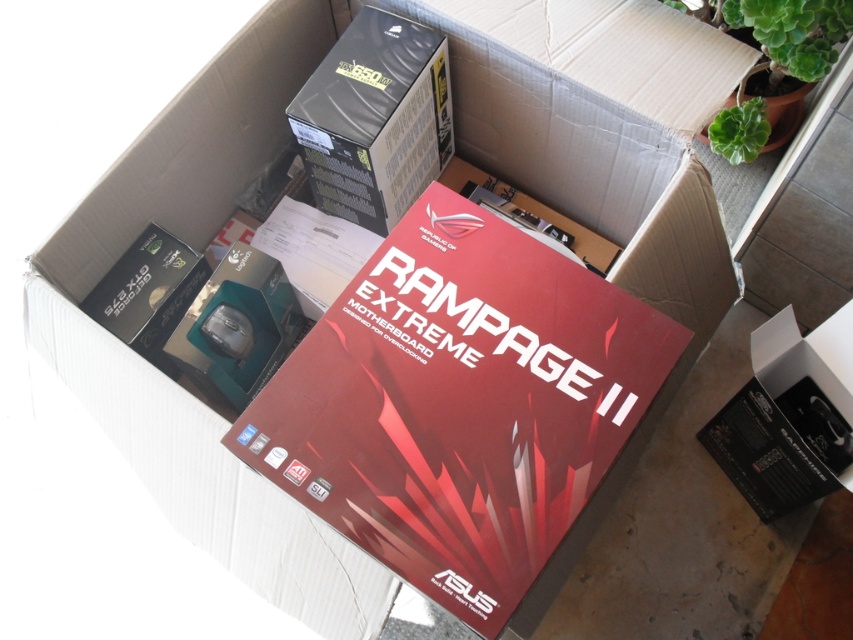
Which is behind, point (393, 172) or point (822, 374)?

Point (822, 374)

Which is below, black matte power supply at upper center or black plastic box at lower right?

Positioned lower is black plastic box at lower right.

You are a GUI agent. You are given a task and a screenshot of the screen. Output one action in this format:
    pyautogui.click(x=<x>, y=<y>)
    Task: Click on the black matte power supply at upper center
    This screenshot has width=853, height=640.
    Given the screenshot: What is the action you would take?
    pyautogui.click(x=375, y=120)

Can you confirm if red matte motherboard at center is smaller than black matte power supply at upper center?

Actually, red matte motherboard at center might be larger than black matte power supply at upper center.

Does red matte motherboard at center have a greater width compared to black matte power supply at upper center?

Yes.

Which is behind, point (647, 310) or point (322, 124)?

Point (322, 124)

Where is `red matte motherboard at center`? red matte motherboard at center is located at coordinates coord(460,404).

Does red matte motherboard at center have a lesser width compared to black plastic box at lower right?

No.

What do you see at coordinates (460, 404) in the screenshot? This screenshot has width=853, height=640. I see `red matte motherboard at center` at bounding box center [460, 404].

The image size is (853, 640). In order to click on red matte motherboard at center in this screenshot , I will do `click(460, 404)`.